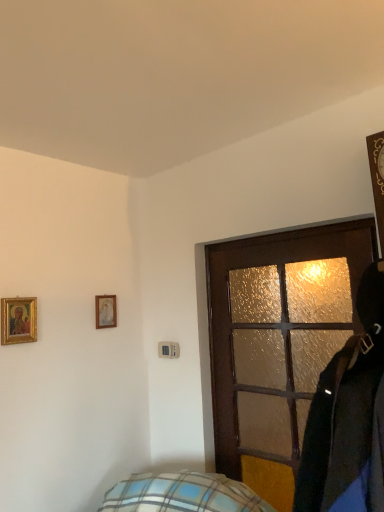
Question: Is matte white picture frame at upper left, the second picture frame from the front, outside of brown textured door at center?

Choices:
 (A) no
 (B) yes

Answer: (B)

Question: Is matte white picture frame at upper left, the first picture frame when ordered from back to front, at the left side of brown textured door at center?

Choices:
 (A) yes
 (B) no

Answer: (A)

Question: Considering the relative positions of matte white picture frame at upper left, the first picture frame when ordered from back to front, and brown textured door at center in the image provided, is matte white picture frame at upper left, the first picture frame when ordered from back to front, to the right of brown textured door at center from the viewer's perspective?

Choices:
 (A) yes
 (B) no

Answer: (B)

Question: Considering the relative sizes of matte white picture frame at upper left, the second picture frame from the front, and brown textured door at center in the image provided, is matte white picture frame at upper left, the second picture frame from the front, bigger than brown textured door at center?

Choices:
 (A) no
 (B) yes

Answer: (A)

Question: Can you confirm if matte white picture frame at upper left, the second picture frame from the left, is taller than brown textured door at center?

Choices:
 (A) no
 (B) yes

Answer: (A)

Question: Is the surface of matte white picture frame at upper left, the first picture frame when ordered from back to front, in direct contact with brown textured door at center?

Choices:
 (A) no
 (B) yes

Answer: (A)

Question: Can you confirm if gold-framed picture at upper left, which is counted as the second picture frame, starting from the right, is thinner than matte white picture frame at upper left, the second picture frame from the front?

Choices:
 (A) yes
 (B) no

Answer: (B)

Question: Does gold-framed picture at upper left, which is counted as the second picture frame, starting from the right, have a smaller size compared to matte white picture frame at upper left, the second picture frame from the left?

Choices:
 (A) no
 (B) yes

Answer: (A)

Question: Does gold-framed picture at upper left, which is counted as the second picture frame, starting from the right, have a greater width compared to matte white picture frame at upper left, which is the 1th picture frame from right to left?

Choices:
 (A) yes
 (B) no

Answer: (A)

Question: Is gold-framed picture at upper left, marked as the second picture frame in a back-to-front arrangement, completely or partially outside of matte white picture frame at upper left, the second picture frame from the front?

Choices:
 (A) no
 (B) yes

Answer: (B)

Question: Is matte white picture frame at upper left, which is the 1th picture frame from right to left, located within gold-framed picture at upper left, which is counted as the second picture frame, starting from the right?

Choices:
 (A) no
 (B) yes

Answer: (A)

Question: From the image's perspective, would you say gold-framed picture at upper left, the first picture frame from the left, is positioned over matte white picture frame at upper left, which is the 1th picture frame from right to left?

Choices:
 (A) yes
 (B) no

Answer: (A)

Question: Can you confirm if brown textured door at center is wider than matte white picture frame at upper left, the second picture frame from the left?

Choices:
 (A) yes
 (B) no

Answer: (A)